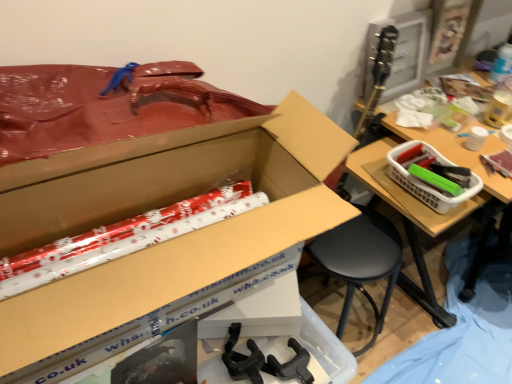
The width and height of the screenshot is (512, 384). Describe the element at coordinates (158, 206) in the screenshot. I see `cardboard box at center` at that location.

This screenshot has width=512, height=384. Identify the location of cardboard box at center. (158, 206).

The width and height of the screenshot is (512, 384). What are the coordinates of `white plastic basket at right` in the screenshot? It's located at (423, 183).

In order to face white plastic basket at right, should I rotate leftwards or rightwards?

You should look right and rotate roughly 23.050 degrees.

Image resolution: width=512 pixels, height=384 pixels. Describe the element at coordinates (423, 183) in the screenshot. I see `white plastic basket at right` at that location.

Measure the distance between point (445, 159) and camera.

Point (445, 159) and camera are 1.29 meters apart from each other.

I want to click on cardboard box at center, so click(x=158, y=206).

Visually, is white plastic basket at right positioned to the left or to the right of cardboard box at center?

white plastic basket at right is to the right of cardboard box at center.

Does white plastic basket at right come behind cardboard box at center?

Yes, the depth of white plastic basket at right is greater than that of cardboard box at center.

Between point (403, 150) and point (33, 296), which one is positioned in front?

Positioned in front is point (33, 296).

From the image's perspective, is white plastic basket at right below cardboard box at center?

Actually, white plastic basket at right appears above cardboard box at center in the image.

From a real-world perspective, who is located higher, white plastic basket at right or cardboard box at center?

cardboard box at center, from a real-world perspective.

Is white plastic basket at right wider or thinner than cardboard box at center?

white plastic basket at right is thinner than cardboard box at center.

Considering the sizes of white plastic basket at right and cardboard box at center in the image, is white plastic basket at right taller or shorter than cardboard box at center?

Clearly, white plastic basket at right is shorter compared to cardboard box at center.

Can you confirm if white plastic basket at right is smaller than cardboard box at center?

Yes, white plastic basket at right is smaller than cardboard box at center.

Is white plastic basket at right surrounding cardboard box at center?

No, cardboard box at center is not a part of white plastic basket at right.

Would you consider white plastic basket at right to be distant from cardboard box at center?

white plastic basket at right is actually quite close to cardboard box at center.

Is white plastic basket at right facing towards cardboard box at center?

No, white plastic basket at right is not aimed at cardboard box at center.

The height and width of the screenshot is (384, 512). I want to click on box above the white plastic basket at right (from a real-world perspective), so click(158, 206).

Considering the positions of objects cardboard box at center and white plastic basket at right in the image provided, who is more to the left, cardboard box at center or white plastic basket at right?

cardboard box at center is more to the left.

Which object is more forward, cardboard box at center or white plastic basket at right?

Positioned in front is cardboard box at center.

Which is farther from the camera, (310,108) or (434,191)?

Positioned behind is point (434,191).

From the image's perspective, would you say cardboard box at center is positioned over white plastic basket at right?

No, from the image's perspective, cardboard box at center is not above white plastic basket at right.

From a real-world perspective, which object stands above the other?

cardboard box at center is physically above.

Which object is thinner, cardboard box at center or white plastic basket at right?

With smaller width is white plastic basket at right.

Which of these two, cardboard box at center or white plastic basket at right, stands shorter?

white plastic basket at right.

Can you confirm if cardboard box at center is smaller than white plastic basket at right?

No, cardboard box at center is not smaller than white plastic basket at right.

Is cardboard box at center inside the boundaries of white plastic basket at right, or outside?

cardboard box at center is spatially situated outside white plastic basket at right.

Is cardboard box at center beside white plastic basket at right?

cardboard box at center and white plastic basket at right are clearly separated.

Could you tell me if cardboard box at center is turned towards white plastic basket at right?

No, cardboard box at center does not turn towards white plastic basket at right.

I want to click on box located below the white plastic basket at right (from the image's perspective), so click(158, 206).

Locate an element on the screen. This screenshot has width=512, height=384. basket below the cardboard box at center (from a real-world perspective) is located at coordinates (423, 183).

This screenshot has width=512, height=384. There is a white plastic basket at right. Find the location of `box above it (from a real-world perspective)`. box above it (from a real-world perspective) is located at coordinates (158, 206).